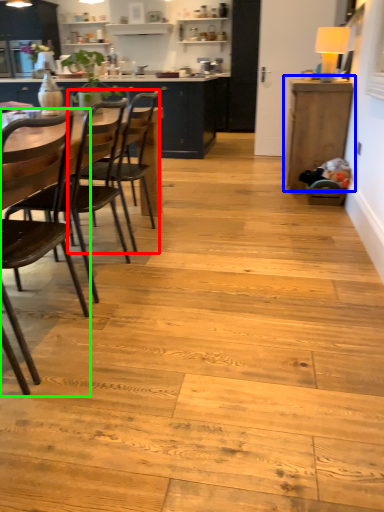
Question: Which object is the farthest from chair (highlighted by a red box)? Choose among these: cabinetry (highlighted by a blue box) or chair (highlighted by a green box).

Choices:
 (A) cabinetry
 (B) chair

Answer: (A)